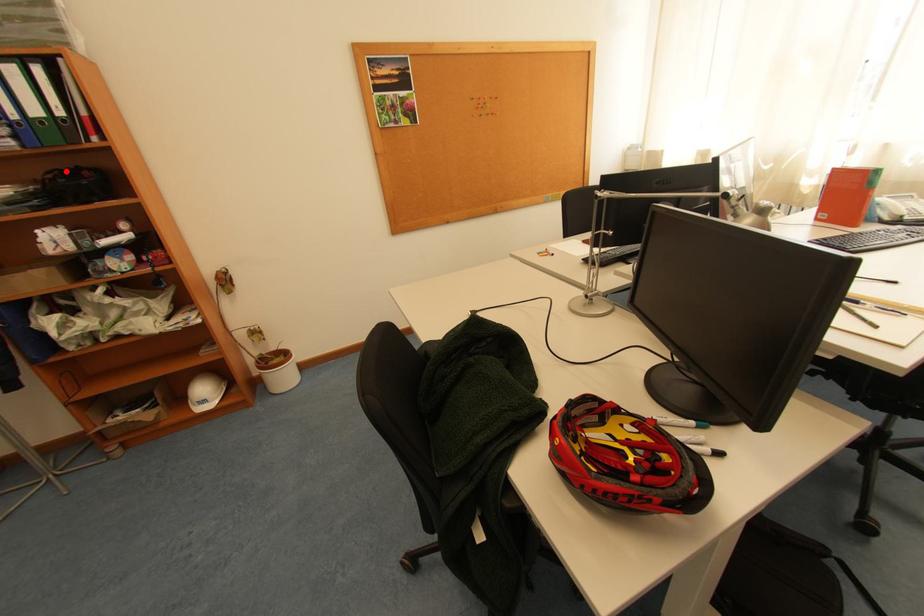
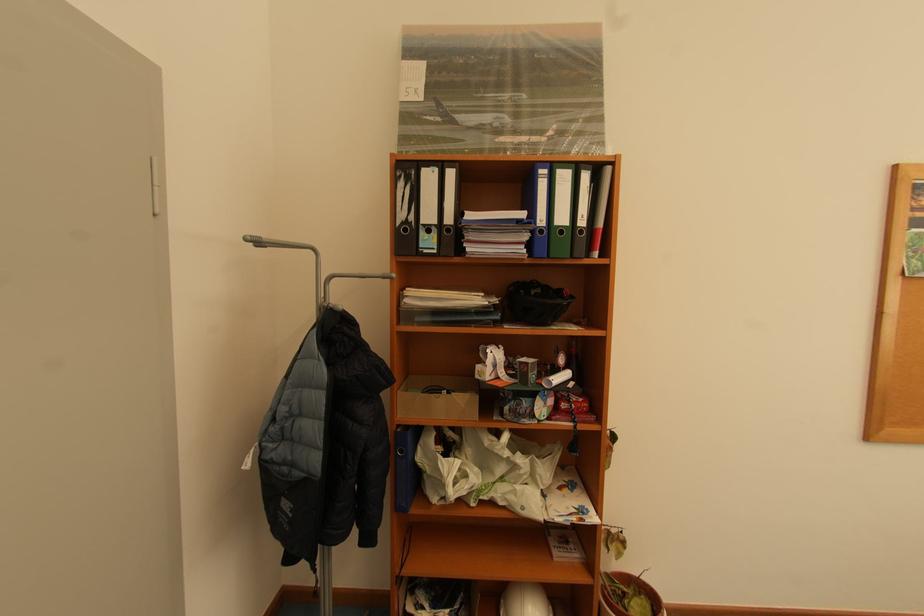
Question: A red point is marked in image1. In image2, is the corresponding 3D point closer to the camera or farther? Reply with the corresponding letter.

Choices:
 (A) The corresponding 3D point is closer.
 (B) The corresponding 3D point is farther.

Answer: (A)